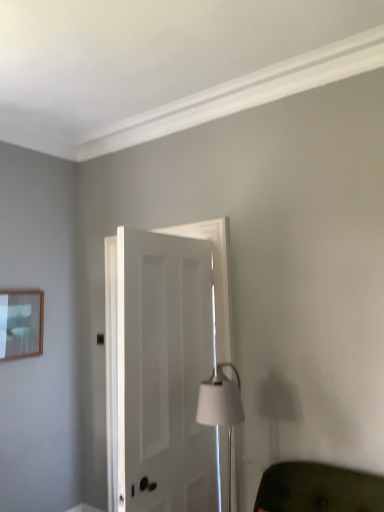
Describe the element at coordinates (221, 407) in the screenshot. Image resolution: width=384 pixels, height=512 pixels. I see `white matte table lamp at center` at that location.

Locate an element on the screen. The width and height of the screenshot is (384, 512). white matte door at center is located at coordinates (162, 370).

What are the coordinates of `white matte table lamp at center` in the screenshot? It's located at (221, 407).

In the image, is wooden picture frame at upper left on the left side or the right side of white matte door at center?

Based on their positions, wooden picture frame at upper left is located to the left of white matte door at center.

Between wooden picture frame at upper left and white matte door at center, which one has less height?

Standing shorter between the two is wooden picture frame at upper left.

Would you consider wooden picture frame at upper left to be distant from white matte door at center?

wooden picture frame at upper left is positioned a significant distance from white matte door at center.

Between point (37, 338) and point (150, 384), which one is positioned behind?

Point (37, 338)

Is white matte table lamp at center turned away from wooden picture frame at upper left?

No, wooden picture frame at upper left is not at the back of white matte table lamp at center.

From the image's perspective, between white matte table lamp at center and wooden picture frame at upper left, which one is located above?

From the image's view, wooden picture frame at upper left is above.

How different are the orientations of white matte table lamp at center and wooden picture frame at upper left in degrees?

The angle between the facing direction of white matte table lamp at center and the facing direction of wooden picture frame at upper left is 97.6 degrees.

Is the depth of white matte door at center greater than that of white matte table lamp at center?

No, it is in front of white matte table lamp at center.

Considering the relative sizes of white matte door at center and white matte table lamp at center in the image provided, is white matte door at center bigger than white matte table lamp at center?

Correct, white matte door at center is larger in size than white matte table lamp at center.

Is white matte door at center far from white matte table lamp at center?

Actually, white matte door at center and white matte table lamp at center are a little close together.

From the picture: Who is bigger, white matte table lamp at center or green fabric couch at lower right?

white matte table lamp at center is bigger.

Based on the photo, how many degrees apart are the facing directions of white matte table lamp at center and green fabric couch at lower right?

3.12 degrees separate the facing orientations of white matte table lamp at center and green fabric couch at lower right.

Do you think white matte table lamp at center is within green fabric couch at lower right, or outside of it?

white matte table lamp at center is not inside green fabric couch at lower right, it's outside.

Between green fabric couch at lower right and white matte table lamp at center, which one has larger width?

green fabric couch at lower right.

Based on the photo, is green fabric couch at lower right positioned with its back to white matte table lamp at center?

No, green fabric couch at lower right's orientation is not away from white matte table lamp at center.

Between green fabric couch at lower right and white matte table lamp at center, which one appears on the left side from the viewer's perspective?

white matte table lamp at center.

From the image's perspective, which object appears higher, green fabric couch at lower right or white matte table lamp at center?

From the image's view, white matte table lamp at center is above.

From the image's perspective, does white matte door at center appear higher than wooden picture frame at upper left?

No, from the image's perspective, white matte door at center is not above wooden picture frame at upper left.

Is point (166, 414) behind point (18, 297)?

No.

Could you tell me if white matte door at center is turned towards wooden picture frame at upper left?

Yes, white matte door at center is turned towards wooden picture frame at upper left.

Is the depth of white matte table lamp at center less than that of white matte door at center?

No, the depth of white matte table lamp at center is greater than that of white matte door at center.

Could white matte door at center be considered to be inside white matte table lamp at center?

No, white matte table lamp at center does not contain white matte door at center.

From the picture: Which is closer, (223, 400) or (168, 314)?

Point (223, 400).

Does white matte table lamp at center have a smaller size compared to white matte door at center?

Yes, white matte table lamp at center is smaller than white matte door at center.

Image resolution: width=384 pixels, height=512 pixels. I want to click on door that appears in front of the wooden picture frame at upper left, so click(162, 370).

I want to click on table lamp that is on the right side of wooden picture frame at upper left, so click(x=221, y=407).

Considering their positions, is white matte door at center positioned further to white matte table lamp at center than green fabric couch at lower right?

Among the two, green fabric couch at lower right is located further to white matte table lamp at center.

When comparing their distances from wooden picture frame at upper left, does white matte door at center or white matte table lamp at center seem further?

Based on the image, white matte table lamp at center appears to be further to wooden picture frame at upper left.

Estimate the real-world distances between objects in this image. Which object is further from white matte door at center, wooden picture frame at upper left or green fabric couch at lower right?

wooden picture frame at upper left.

From the image, which object appears to be farther from wooden picture frame at upper left, green fabric couch at lower right or white matte table lamp at center?

Based on the image, green fabric couch at lower right appears to be further to wooden picture frame at upper left.

Looking at this image, which object lies further to the anchor point green fabric couch at lower right, wooden picture frame at upper left or white matte table lamp at center?

wooden picture frame at upper left.

Looking at the image, which one is located further to green fabric couch at lower right, white matte table lamp at center or wooden picture frame at upper left?

Among the two, wooden picture frame at upper left is located further to green fabric couch at lower right.

In the scene shown: Estimate the real-world distances between objects in this image. Which object is closer to white matte door at center, green fabric couch at lower right or white matte table lamp at center?

white matte table lamp at center is closer to white matte door at center.

From the image, which object appears to be farther from green fabric couch at lower right, white matte table lamp at center or white matte door at center?

Based on the image, white matte door at center appears to be further to green fabric couch at lower right.

Image resolution: width=384 pixels, height=512 pixels. In order to click on door between wooden picture frame at upper left and green fabric couch at lower right from left to right in this screenshot , I will do `click(162, 370)`.

Locate an element on the screen. The width and height of the screenshot is (384, 512). table lamp between white matte door at center and green fabric couch at lower right in the horizontal direction is located at coordinates (221, 407).

Locate an element on the screen. This screenshot has width=384, height=512. door located between wooden picture frame at upper left and white matte table lamp at center in the left-right direction is located at coordinates (162, 370).

Where is `table lamp situated between wooden picture frame at upper left and green fabric couch at lower right from left to right`? The width and height of the screenshot is (384, 512). table lamp situated between wooden picture frame at upper left and green fabric couch at lower right from left to right is located at coordinates [221, 407].